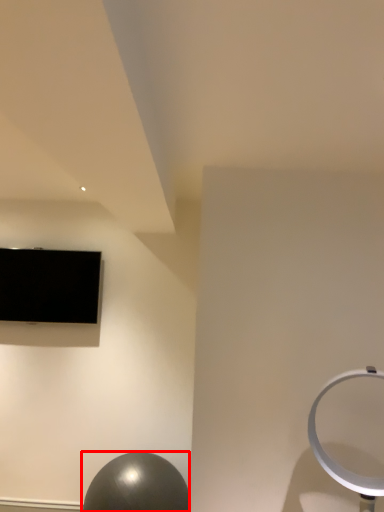
Question: From the image's perspective, what is the correct spatial relationship of ball (annotated by the red box) in relation to television?

Choices:
 (A) above
 (B) below

Answer: (B)